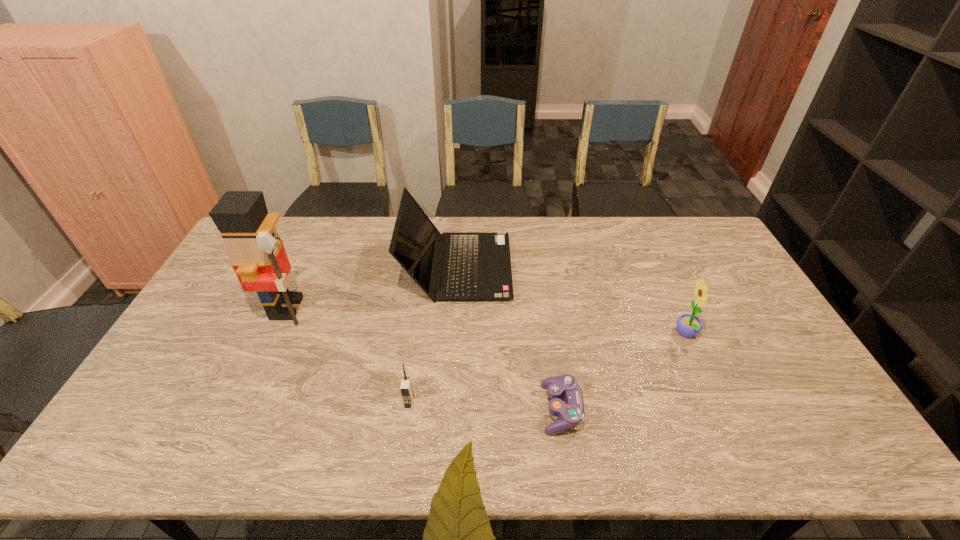
Find the location of a particular element. The height and width of the screenshot is (540, 960). the tallest object is located at coordinates coord(256,252).

Where is `nutcracker`? nutcracker is located at coordinates (256, 252).

Locate an element on the screen. laptop computer is located at coordinates (476, 266).

Find the location of `the rightmost object`. the rightmost object is located at coordinates (688, 325).

At what (x,y) coordinates should I click in order to perform the action: click on the second shortest object. Please return your answer as a coordinate pair (x, y). Looking at the image, I should click on (406, 390).

Image resolution: width=960 pixels, height=540 pixels. Identify the location of the shortest object. 570,413.

Locate an element on the screen. the second object from right to left is located at coordinates (570, 413).

This screenshot has height=540, width=960. Find the location of `vacant space located in front of the leftmost object holding the staff`. vacant space located in front of the leftmost object holding the staff is located at coordinates (348, 308).

This screenshot has width=960, height=540. I want to click on vacant space located on the screen of the laptop computer, so click(598, 267).

This screenshot has width=960, height=540. I want to click on free location located 0.320m on the front-facing side of the sunflower, so click(x=565, y=335).